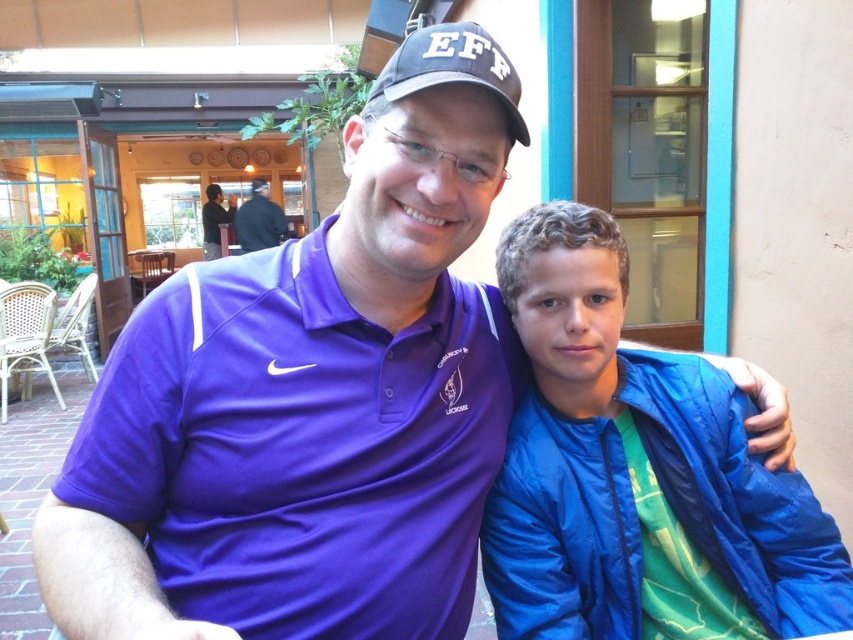
Which of these two, blue nylon jacket at right or black matte baseball cap at upper center, stands shorter?

black matte baseball cap at upper center

Does blue nylon jacket at right appear over black matte baseball cap at upper center?

No, blue nylon jacket at right is not above black matte baseball cap at upper center.

Is point (802, 509) positioned in front of point (422, 68)?

No, it is not.

I want to click on blue nylon jacket at right, so click(x=735, y=496).

Which of these two, purple polyester polo shirt at center or black fabric shirt at upper center, stands taller?

With more height is black fabric shirt at upper center.

Is purple polyester polo shirt at center below black fabric shirt at upper center?

Indeed, purple polyester polo shirt at center is positioned under black fabric shirt at upper center.

Which is behind, point (270, 401) or point (238, 230)?

Positioned behind is point (238, 230).

At what (x,y) coordinates should I click in order to perform the action: click on purple polyester polo shirt at center. Please return your answer as a coordinate pair (x, y). This screenshot has height=640, width=853. Looking at the image, I should click on (302, 448).

Between point (259, 305) and point (704, 460), which one is positioned in front?

Positioned in front is point (259, 305).

Between point (325, 596) and point (721, 452), which one is positioned behind?

The point (721, 452) is behind.

Locate an element on the screen. Image resolution: width=853 pixels, height=640 pixels. purple polyester polo shirt at center is located at coordinates (302, 448).